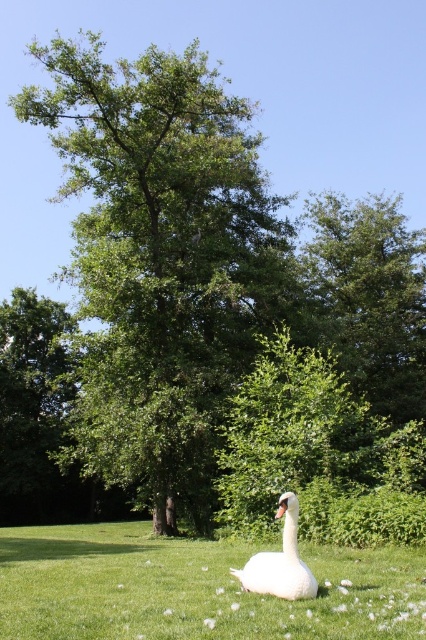
You are a photographer trying to capture both the white feathered swan at center and the white glossy swan at center in a single shot. Since they are both at the center, which one is more to the left?

The white feathered swan at center is positioned on the left side of white glossy swan at center, so it is more to the left.

You are standing in the middle of the lawn and see the green leafy tree at center and the white feathered swan at center. Which object is positioned to the left of the other?

The green leafy tree at center is positioned to the left of the white feathered swan at center.